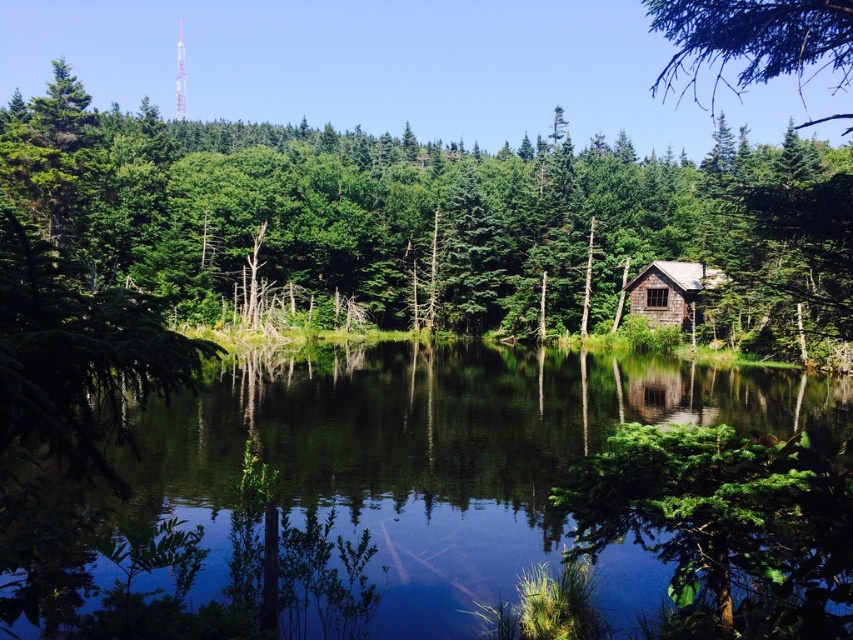
You are standing at the center of the image and want to walk towards the green matte tree at center. Which direction should you head?

The green matte tree at center is already at the center of the image, so you are already facing it directly. No need to change direction.